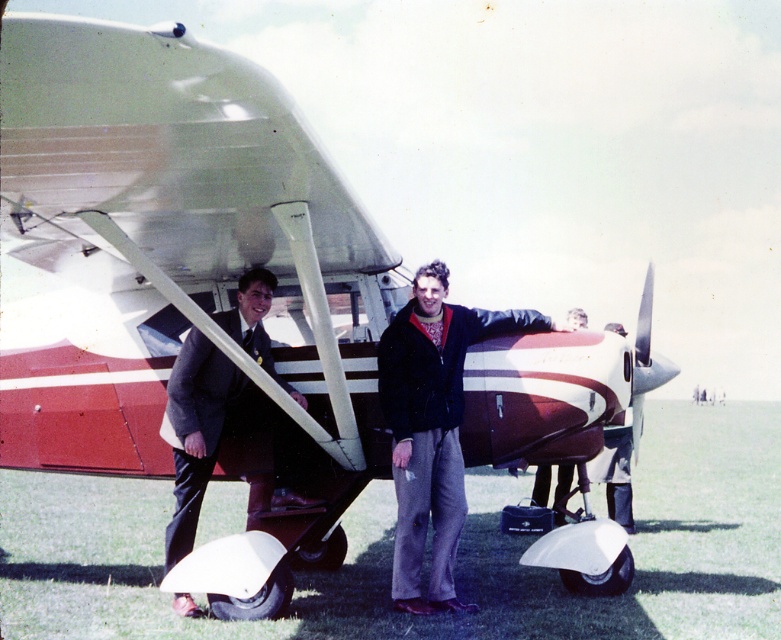
Is dark gray suit at lower left thinner than matte black jacket at center?

Incorrect, dark gray suit at lower left's width is not less than matte black jacket at center's.

Does dark gray suit at lower left appear over matte black jacket at center?

Indeed, dark gray suit at lower left is positioned over matte black jacket at center.

Does point (202, 474) come behind point (544, 502)?

No, it is not.

You are a GUI agent. You are given a task and a screenshot of the screen. Output one action in this format:
    pyautogui.click(x=<x>, y=<y>)
    Task: Click on the dark gray suit at lower left
    This screenshot has width=781, height=640.
    Given the screenshot: What is the action you would take?
    pyautogui.click(x=194, y=432)

Between dark blue leather jacket at center and dark gray suit at lower left, which one appears on the right side from the viewer's perspective?

From the viewer's perspective, dark blue leather jacket at center appears more on the right side.

Does point (415, 300) come behind point (209, 365)?

No, (415, 300) is closer to viewer.

Locate an element on the screen. dark blue leather jacket at center is located at coordinates (432, 428).

Is the position of dark blue leather jacket at center less distant than that of matte black jacket at center?

Yes, it is.

Is point (394, 368) more distant than point (555, 515)?

No, (394, 368) is closer to viewer.

The width and height of the screenshot is (781, 640). What do you see at coordinates (432, 428) in the screenshot?
I see `dark blue leather jacket at center` at bounding box center [432, 428].

You are a GUI agent. You are given a task and a screenshot of the screen. Output one action in this format:
    pyautogui.click(x=<x>, y=<y>)
    Task: Click on the dark blue leather jacket at center
    
    Given the screenshot: What is the action you would take?
    pyautogui.click(x=432, y=428)